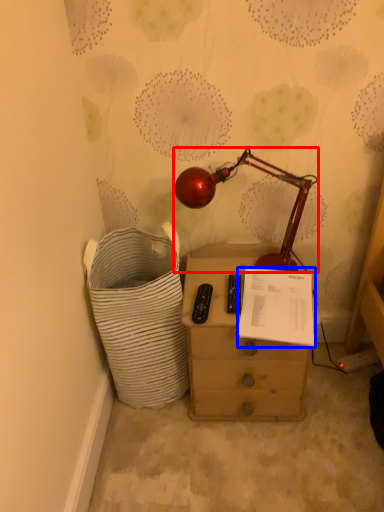
Question: Which object appears closest to the camera in this image, lamp (highlighted by a red box) or document (highlighted by a blue box)?

Choices:
 (A) lamp
 (B) document

Answer: (A)